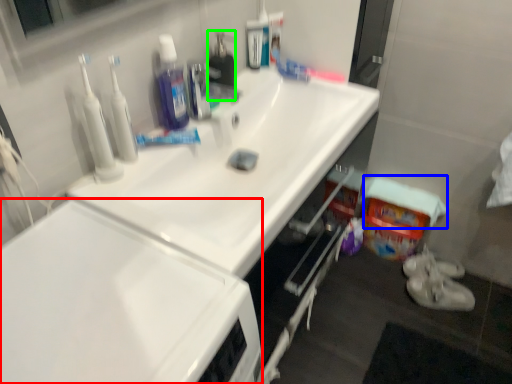
Question: Which object is the closest to the cabinetry (highlighted by a red box)? Choose among these: towel/napkin (highlighted by a blue box) or cleaning products (highlighted by a green box).

Choices:
 (A) towel/napkin
 (B) cleaning products

Answer: (B)